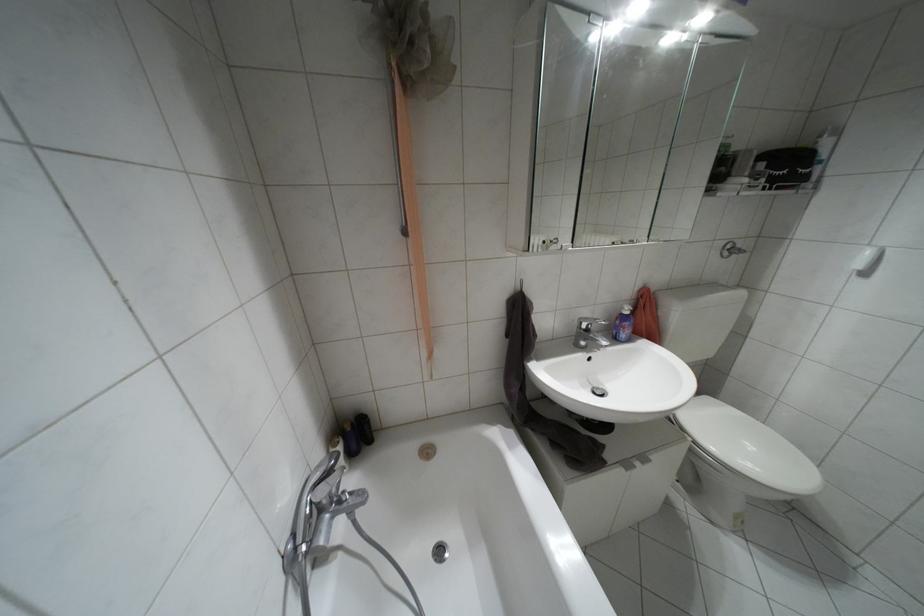
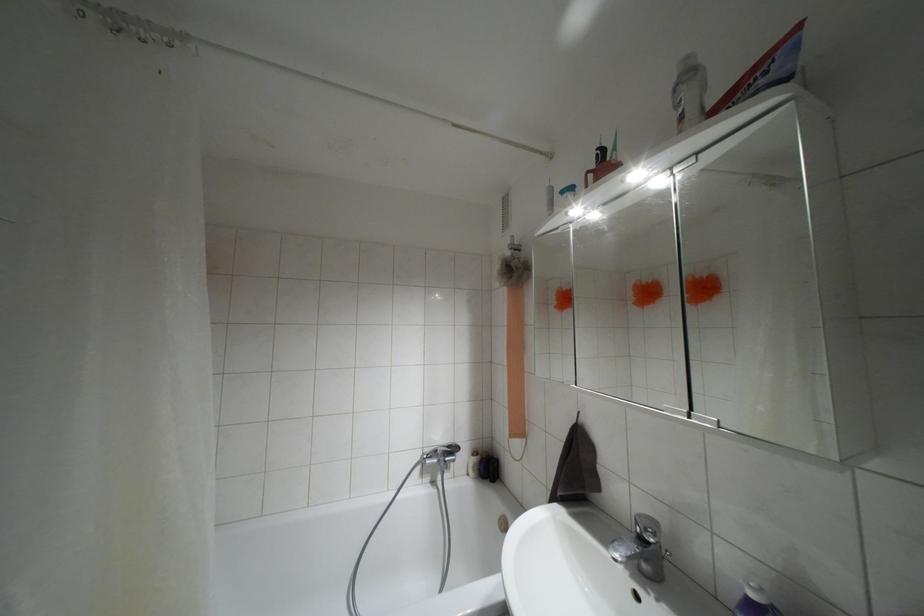
The point at (626, 312) is marked in the first image. Where is the corresponding point in the second image?

(751, 594)